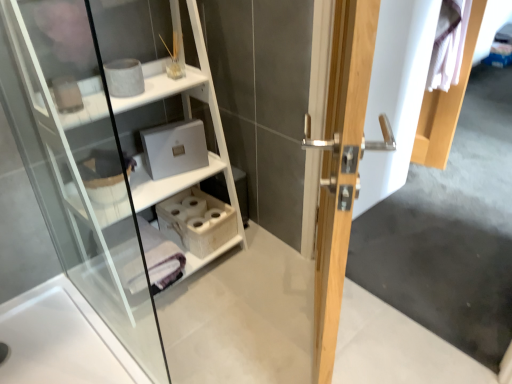
This screenshot has width=512, height=384. What do you see at coordinates (197, 221) in the screenshot? I see `wooden tissue box at lower center` at bounding box center [197, 221].

Measure the distance between wooden tissue box at lower center and camera.

wooden tissue box at lower center and camera are 6.06 feet apart from each other.

Locate an element on the screen. The height and width of the screenshot is (384, 512). white wood shelf at upper left is located at coordinates (118, 155).

Which of these two, light wood door handle at center or wooden tissue box at lower center, is wider?

Wider between the two is wooden tissue box at lower center.

Looking at this image, does light wood door handle at center appear on the left side of wooden tissue box at lower center?

No.

Which of these two, light wood door handle at center or wooden tissue box at lower center, stands taller?

light wood door handle at center.

Considering the relative sizes of white wood shelf at upper left and light wood door handle at center in the image provided, is white wood shelf at upper left bigger than light wood door handle at center?

Indeed, white wood shelf at upper left has a larger size compared to light wood door handle at center.

From the image's perspective, is white wood shelf at upper left located above light wood door handle at center?

Yes, from the image's perspective, white wood shelf at upper left is on top of light wood door handle at center.

Is wooden tissue box at lower center next to white wood shelf at upper left?

No, wooden tissue box at lower center is not with white wood shelf at upper left.

From the image's perspective, is wooden tissue box at lower center on top of white wood shelf at upper left?

No.

Between point (191, 219) and point (128, 137), which one is positioned behind?

The point (191, 219) is behind.

Based on the photo, is wooden tissue box at lower center to the left or to the right of white wood shelf at upper left in the image?

wooden tissue box at lower center is to the right of white wood shelf at upper left.

Measure the distance between white wood shelf at upper left and wooden tissue box at lower center.

white wood shelf at upper left and wooden tissue box at lower center are 11.42 inches apart from each other.

Which of these two, white wood shelf at upper left or wooden tissue box at lower center, stands shorter?

wooden tissue box at lower center is shorter.

From the image's perspective, relative to wooden tissue box at lower center, is white wood shelf at upper left above or below?

white wood shelf at upper left is above wooden tissue box at lower center.

Is white wood shelf at upper left to the right of wooden tissue box at lower center from the viewer's perspective?

No, white wood shelf at upper left is not to the right of wooden tissue box at lower center.

In terms of size, does light wood door handle at center appear bigger or smaller than white wood shelf at upper left?

In the image, light wood door handle at center appears to be smaller than white wood shelf at upper left.

Is white wood shelf at upper left completely or partially inside light wood door handle at center?

Actually, white wood shelf at upper left is outside light wood door handle at center.

Which is further, (320,366) or (120,183)?

The point (120,183) is farther from the camera.

From the image's perspective, is wooden tissue box at lower center above or below light wood door handle at center?

From the image's perspective, wooden tissue box at lower center appears below light wood door handle at center.

Are wooden tissue box at lower center and light wood door handle at center beside each other?

wooden tissue box at lower center and light wood door handle at center are clearly separated.

Which object is positioned more to the right, wooden tissue box at lower center or light wood door handle at center?

light wood door handle at center is more to the right.

Could light wood door handle at center be considered to be inside wooden tissue box at lower center?

No, light wood door handle at center is not surrounded by wooden tissue box at lower center.

You are a GUI agent. You are given a task and a screenshot of the screen. Output one action in this format:
    pyautogui.click(x=<x>, y=<y>)
    Task: Click on the cabinet on the left of light wood door handle at center
    The image size is (512, 384).
    Given the screenshot: What is the action you would take?
    pyautogui.click(x=197, y=221)

Where is `door lying below the white wood shelf at upper left (from the image's perspective)`? The height and width of the screenshot is (384, 512). door lying below the white wood shelf at upper left (from the image's perspective) is located at coordinates (342, 165).

Consider the image. Which object lies further to the anchor point wooden tissue box at lower center, light wood door handle at center or white wood shelf at upper left?

Among the two, light wood door handle at center is located further to wooden tissue box at lower center.

Based on their spatial positions, is wooden tissue box at lower center or white wood shelf at upper left further from light wood door handle at center?

Based on the image, white wood shelf at upper left appears to be further to light wood door handle at center.

Looking at this image, considering their positions, is light wood door handle at center positioned closer to white wood shelf at upper left than wooden tissue box at lower center?

Based on the image, wooden tissue box at lower center appears to be nearer to white wood shelf at upper left.

Estimate the real-world distances between objects in this image. Which object is further from light wood door handle at center, white wood shelf at upper left or wooden tissue box at lower center?

white wood shelf at upper left.

In the scene shown: When comparing their distances from wooden tissue box at lower center, does white wood shelf at upper left or light wood door handle at center seem further?

light wood door handle at center.

When comparing their distances from white wood shelf at upper left, does wooden tissue box at lower center or light wood door handle at center seem further?

light wood door handle at center.

Locate an element on the screen. shelf positioned between light wood door handle at center and wooden tissue box at lower center from near to far is located at coordinates (118, 155).